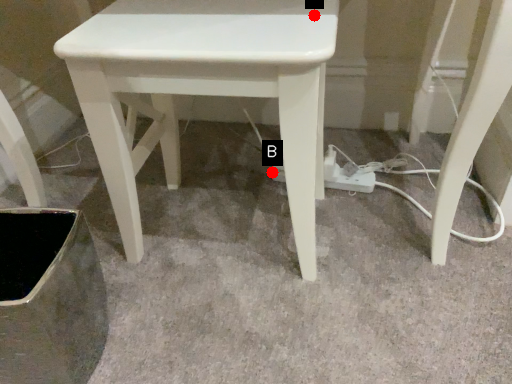
Question: Two points are circled on the image, labeled by A and B beside each circle. Which point is further to the camera?

Choices:
 (A) A is further
 (B) B is further

Answer: (B)